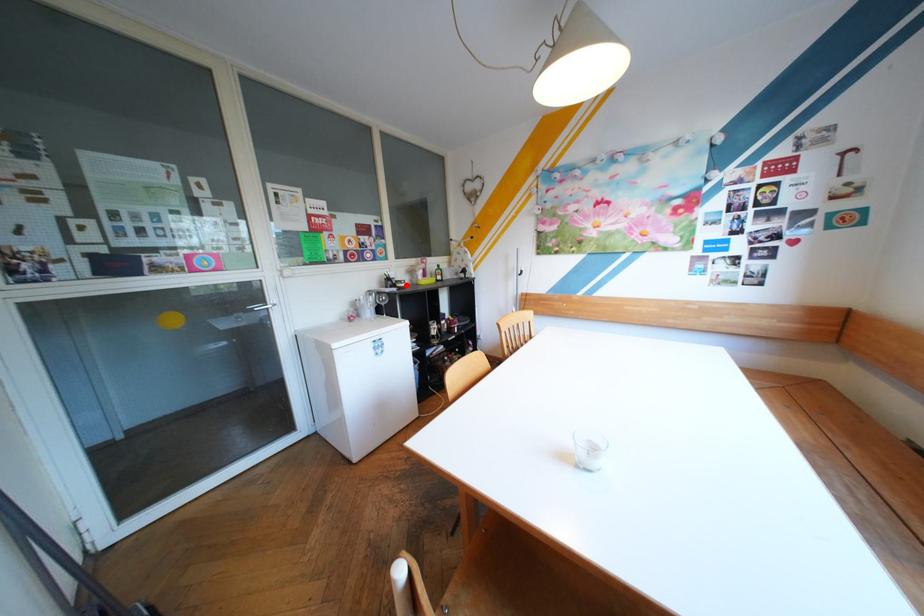
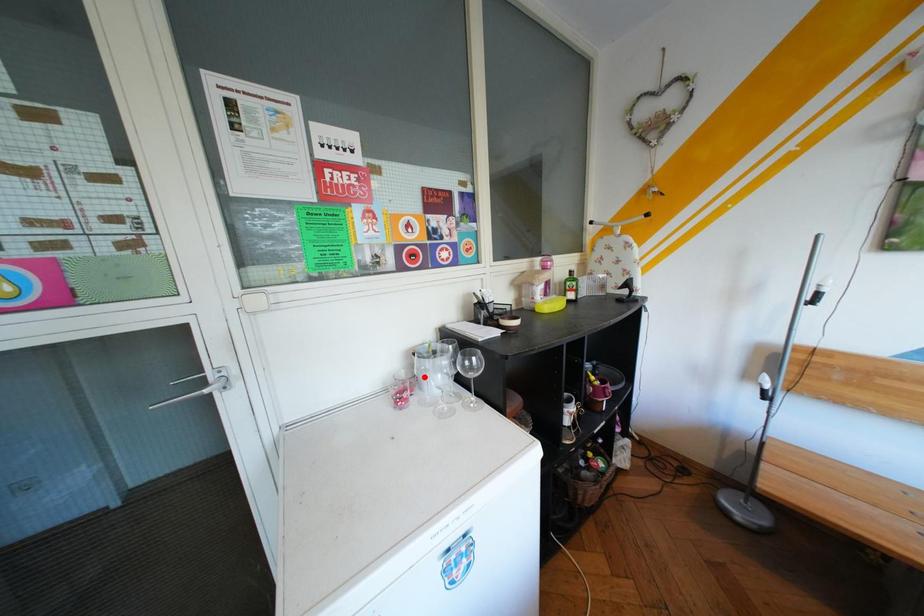
I am providing you with two images of the same scene from different viewpoints. A red point is marked on the first image and another point is marked on the second image. Is the red point in image1 aligned with the point shown in image2?

No